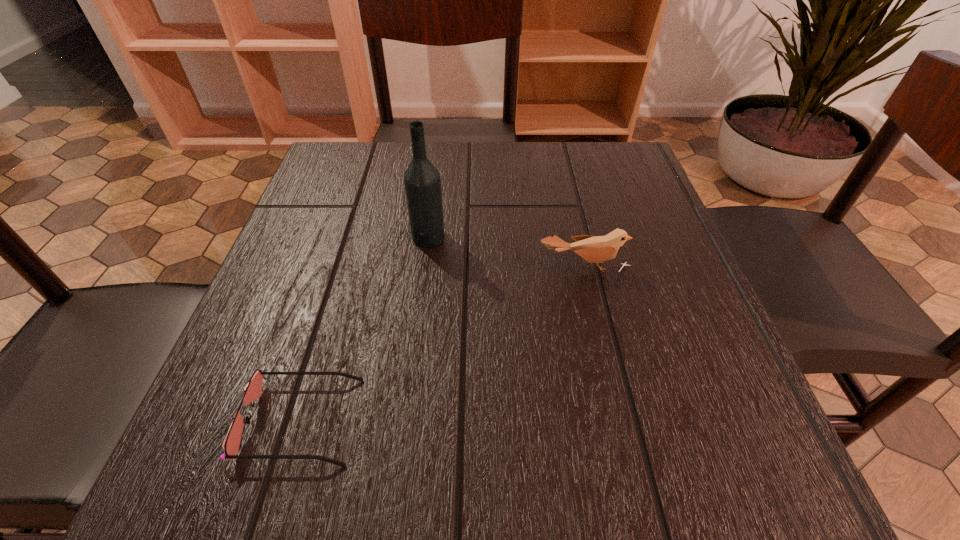
Where is `vodka`? Image resolution: width=960 pixels, height=540 pixels. vodka is located at coordinates (422, 182).

The width and height of the screenshot is (960, 540). I want to click on the second object from right to left, so click(x=422, y=182).

The image size is (960, 540). I want to click on the rightmost object, so click(x=594, y=249).

Locate an element on the screen. the second tallest object is located at coordinates (594, 249).

You are a GUI agent. You are given a task and a screenshot of the screen. Output one action in this format:
    pyautogui.click(x=<x>, y=<y>)
    Task: Click on the shortest object
    Image resolution: width=960 pixels, height=540 pixels.
    Given the screenshot: What is the action you would take?
    pyautogui.click(x=252, y=391)

You are a GUI agent. You are given a task and a screenshot of the screen. Output one action in this format:
    pyautogui.click(x=<x>, y=<y>)
    Task: Click on the nearest object
    Image resolution: width=960 pixels, height=540 pixels.
    Given the screenshot: What is the action you would take?
    pyautogui.click(x=252, y=391)

This screenshot has height=540, width=960. What are the coordinates of `vacant space located on the front of the farthest object` in the screenshot? It's located at (411, 377).

I want to click on free point located 0.100m at the beak of the second nearest object, so click(596, 321).

I want to click on vacant space located on the bridge of the leftmost object, so click(x=591, y=420).

Find the location of `object that is at the near edge`. object that is at the near edge is located at coordinates (252, 391).